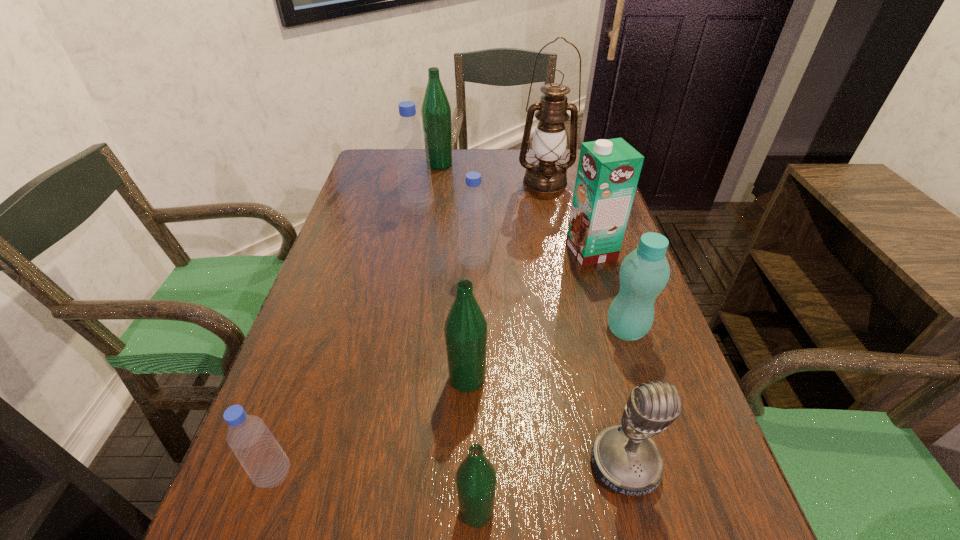
Locate an element on the screen. The height and width of the screenshot is (540, 960). vacant position located on the front of the carton is located at coordinates (630, 381).

Where is `free space located 0.260m on the left of the second nearest blue bottle`? The width and height of the screenshot is (960, 540). free space located 0.260m on the left of the second nearest blue bottle is located at coordinates (353, 262).

Identify the location of vacant space positioned 0.230m on the front of the third nearest bottle. (464, 533).

Identify the location of free space located 0.150m on the front of the fifth nearest object. The image size is (960, 540). [x=653, y=413].

The height and width of the screenshot is (540, 960). What are the coordinates of `vacant space located 0.150m on the back of the leftmost object` in the screenshot? It's located at (307, 381).

Locate an element on the screen. The image size is (960, 540). free space located 0.050m on the right of the nearest green bottle is located at coordinates (528, 510).

The image size is (960, 540). What are the coordinates of `oil lamp that is at the far edge` in the screenshot? It's located at (545, 175).

The height and width of the screenshot is (540, 960). In order to click on bottle that is at the far edge in this screenshot , I will do `click(436, 111)`.

Locate an element on the screen. Image resolution: width=960 pixels, height=540 pixels. oil lamp present at the right edge is located at coordinates click(x=545, y=175).

Identify the location of carton present at the right edge. The height and width of the screenshot is (540, 960). (608, 171).